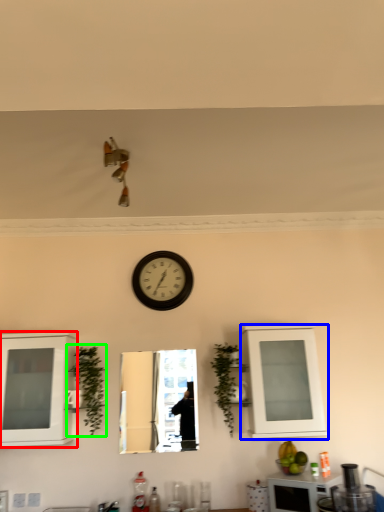
Question: Which object is the closest to the cabinetry (highlighted by a red box)? Choose among these: cabinetry (highlighted by a blue box) or plant (highlighted by a green box).

Choices:
 (A) cabinetry
 (B) plant

Answer: (B)